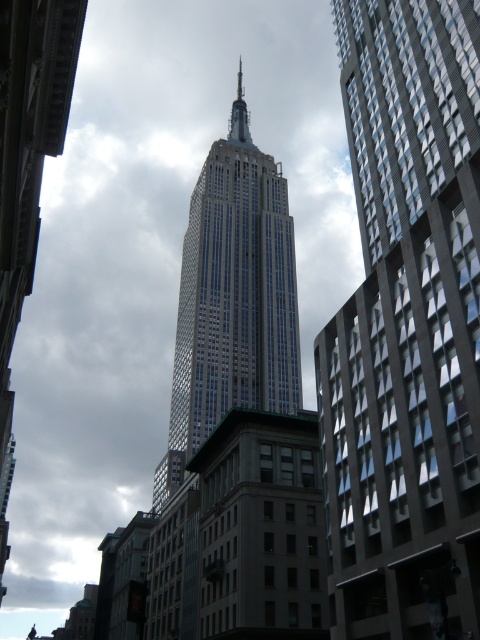
In the scene shown: Can you confirm if gray glass skyscraper at right is positioned above glassy steel tower at center?

Actually, gray glass skyscraper at right is below glassy steel tower at center.

Can you confirm if gray glass skyscraper at right is positioned below glassy steel tower at center?

Yes, gray glass skyscraper at right is below glassy steel tower at center.

This screenshot has height=640, width=480. Describe the element at coordinates (406, 330) in the screenshot. I see `gray glass skyscraper at right` at that location.

Where is `gray glass skyscraper at right`? gray glass skyscraper at right is located at coordinates (406, 330).